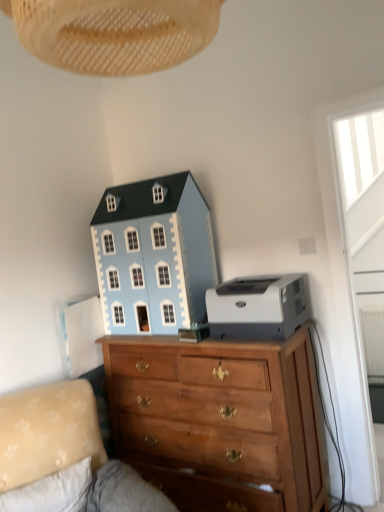
Question: Based on their sizes in the image, would you say wooden chest of drawers at center is bigger or smaller than light blue painted wood dollhouse at upper center?

Choices:
 (A) small
 (B) big

Answer: (B)

Question: Is wooden chest of drawers at center taller or shorter than light blue painted wood dollhouse at upper center?

Choices:
 (A) short
 (B) tall

Answer: (B)

Question: Estimate the real-world distances between objects in this image. Which object is closer to the woven beige lampshade at upper center?

Choices:
 (A) light blue painted wood dollhouse at upper center
 (B) velvet beige couch at lower left
 (C) white plastic printer at right
 (D) wooden chest of drawers at center

Answer: (C)

Question: Which is farther from the velvet beige couch at lower left?

Choices:
 (A) wooden chest of drawers at center
 (B) light blue painted wood dollhouse at upper center
 (C) woven beige lampshade at upper center
 (D) white plastic printer at right

Answer: (C)